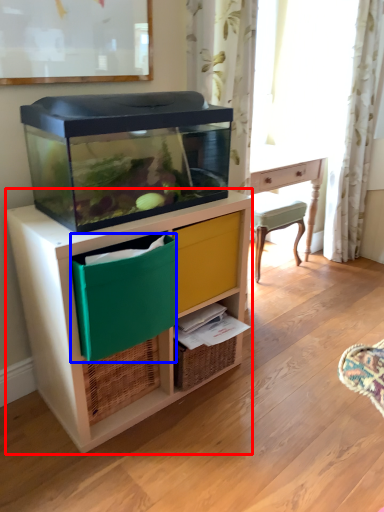
Question: Which of the following is the farthest to the observer, chest of drawers (highlighted by a red box) or storage box (highlighted by a blue box)?

Choices:
 (A) chest of drawers
 (B) storage box

Answer: (A)